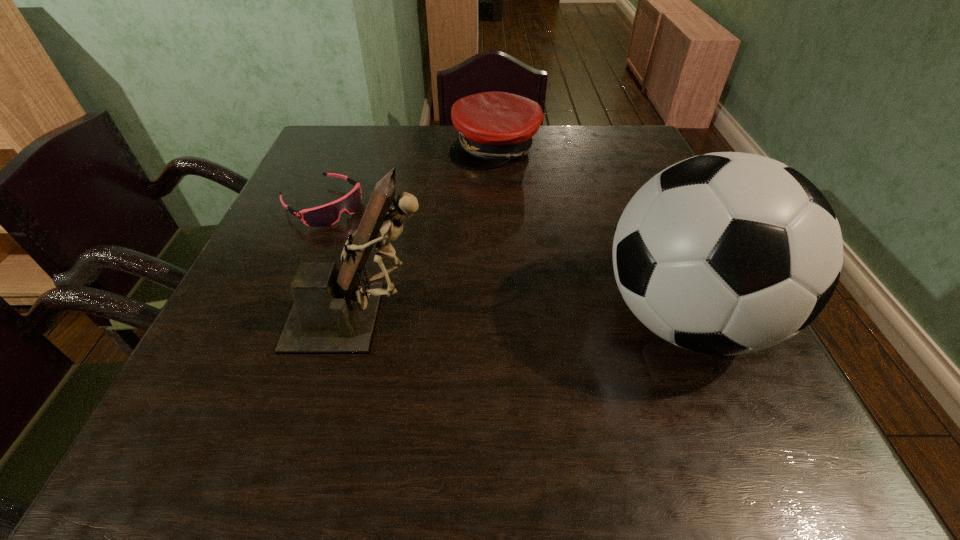
The height and width of the screenshot is (540, 960). Find the location of `figurine`. figurine is located at coordinates (334, 312).

Image resolution: width=960 pixels, height=540 pixels. In order to click on soccer ball in this screenshot , I will do click(x=727, y=253).

This screenshot has width=960, height=540. Find the location of `the third tallest object`. the third tallest object is located at coordinates (494, 128).

Locate an element on the screen. This screenshot has width=960, height=540. the third object from left to right is located at coordinates (494, 128).

You are a GUI agent. You are given a task and a screenshot of the screen. Output one action in this format:
    pyautogui.click(x=<x>, y=<y>)
    Task: Click on the goggles
    
    Given the screenshot: What is the action you would take?
    pyautogui.click(x=325, y=215)

The width and height of the screenshot is (960, 540). I want to click on the third nearest object, so click(x=325, y=215).

The height and width of the screenshot is (540, 960). Identify the location of free space located 0.350m on the front-facing side of the figurine. (621, 317).

Identify the location of free space located on the back of the rightmost object. (619, 165).

The height and width of the screenshot is (540, 960). I want to click on vacant space located 0.220m at the front of the third object from left to right where the visor is located, so click(489, 223).

This screenshot has height=540, width=960. In order to click on free spot located 0.240m at the front of the third object from left to right where the visor is located in this screenshot , I will do `click(488, 228)`.